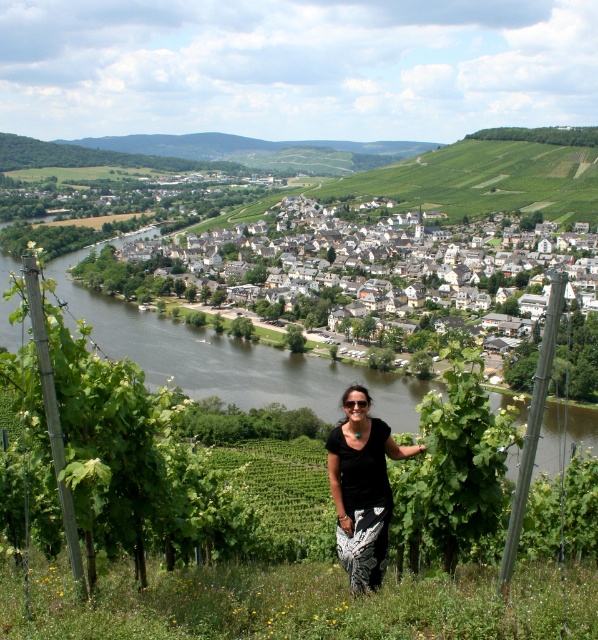
What do you see at coordinates (492, 173) in the screenshot?
I see `green grassy hillside at upper center` at bounding box center [492, 173].

Describe the element at coordinates (492, 173) in the screenshot. I see `green grassy hillside at upper center` at that location.

At what (x,y) coordinates should I click in order to perform the action: click on green grassy hillside at upper center. Please return your answer as a coordinate pair (x, y). The width and height of the screenshot is (598, 640). Looking at the image, I should click on (492, 173).

Identify the location of white stone houses at center. (371, 266).

Can you confirm if white stone houses at center is shorter than green grassy hillside at upper center?

No.

The height and width of the screenshot is (640, 598). Identify the location of white stone houses at center. (371, 266).

Is white stone houses at center above dark brown water at center?

Correct, white stone houses at center is located above dark brown water at center.

Between white stone houses at center and dark brown water at center, which one is positioned higher?

Positioned higher is white stone houses at center.

Where is `white stone houses at center`? white stone houses at center is located at coordinates (371, 266).